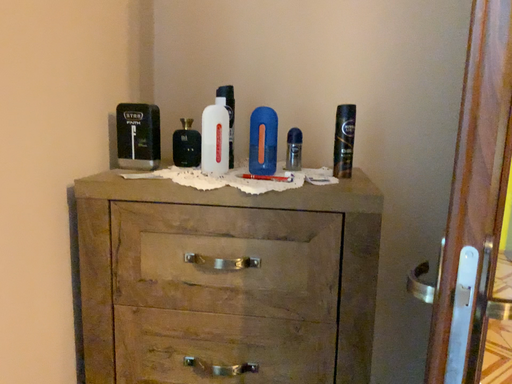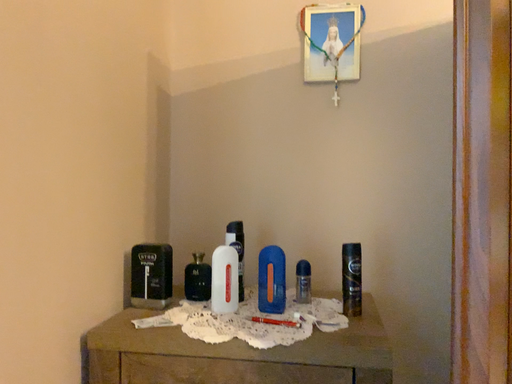
Question: How did the camera likely rotate when shooting the video?

Choices:
 (A) rotated upward
 (B) rotated downward

Answer: (A)